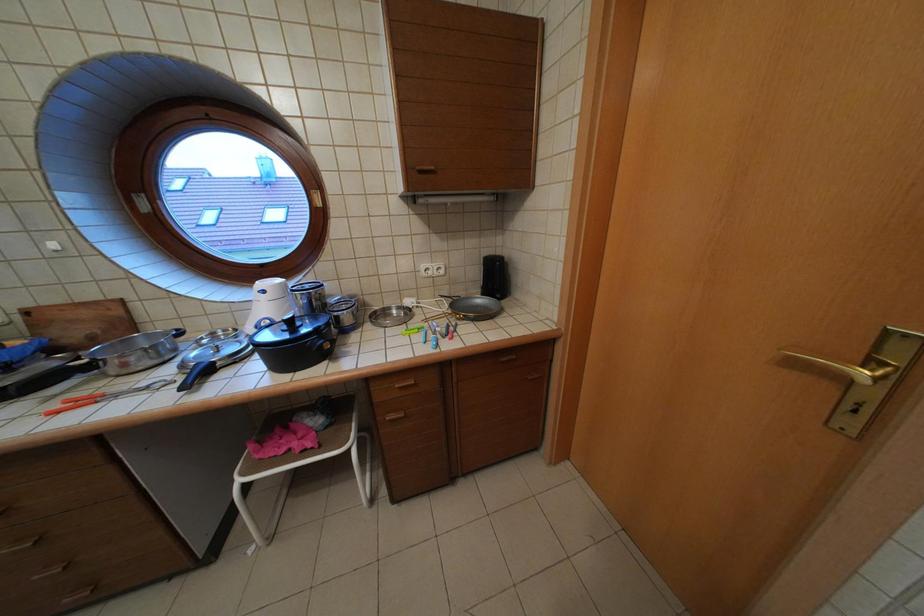
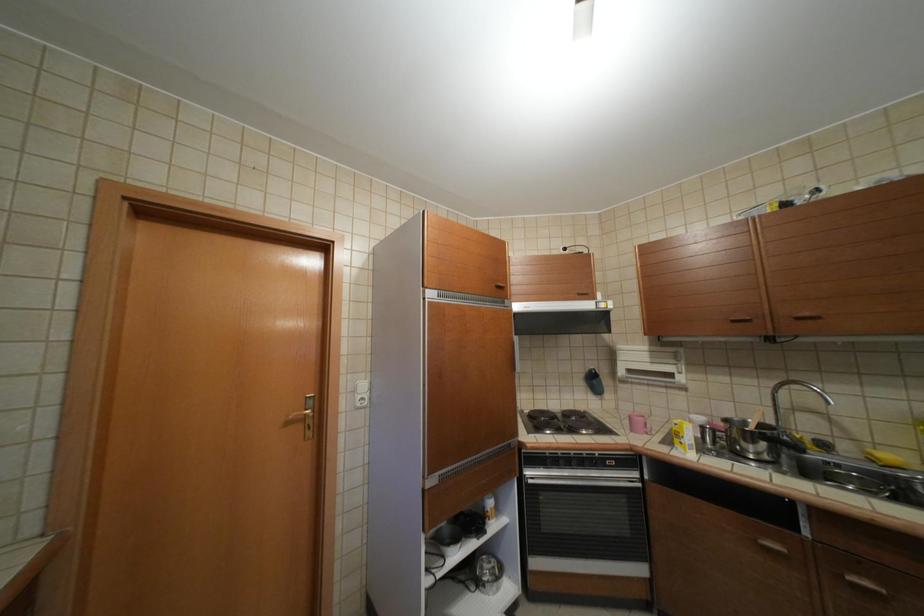
Question: The camera is either moving clockwise (left) or counter-clockwise (right) around the object. The first image is from the beginning of the video and the second image is from the end. Is the camera moving left or right when shooting the video?

Choices:
 (A) Left
 (B) Right

Answer: (A)